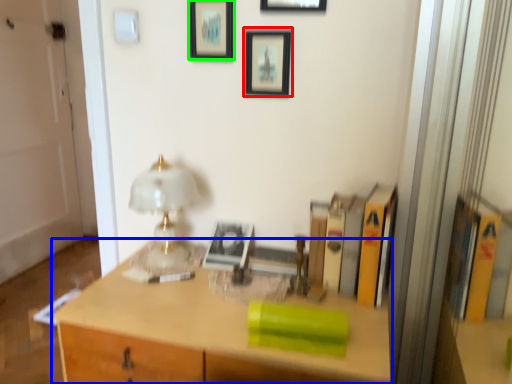
Question: Estimate the real-world distances between objects in this image. Which object is farther from picture frame (highlighted by a red box), desk (highlighted by a blue box) or picture frame (highlighted by a green box)?

Choices:
 (A) desk
 (B) picture frame

Answer: (A)